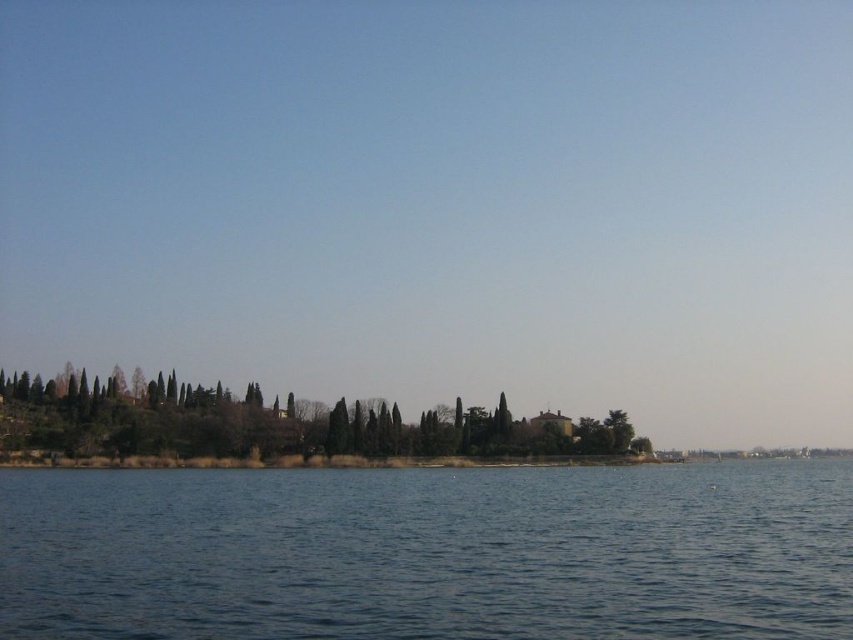
Between blue water at center and green textured trees at center, which one is positioned lower?

blue water at center is below.

Is blue water at center bigger than green textured trees at center?

Yes.

Identify the location of blue water at center. (428, 552).